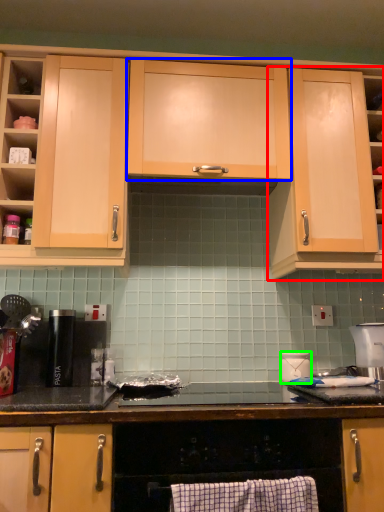
Question: Based on their relative distances, which object is nearer to cabinetry (highlighted by a red box)? Choose from cabinetry (highlighted by a blue box) and kitchen appliance (highlighted by a green box).

Choices:
 (A) cabinetry
 (B) kitchen appliance

Answer: (A)